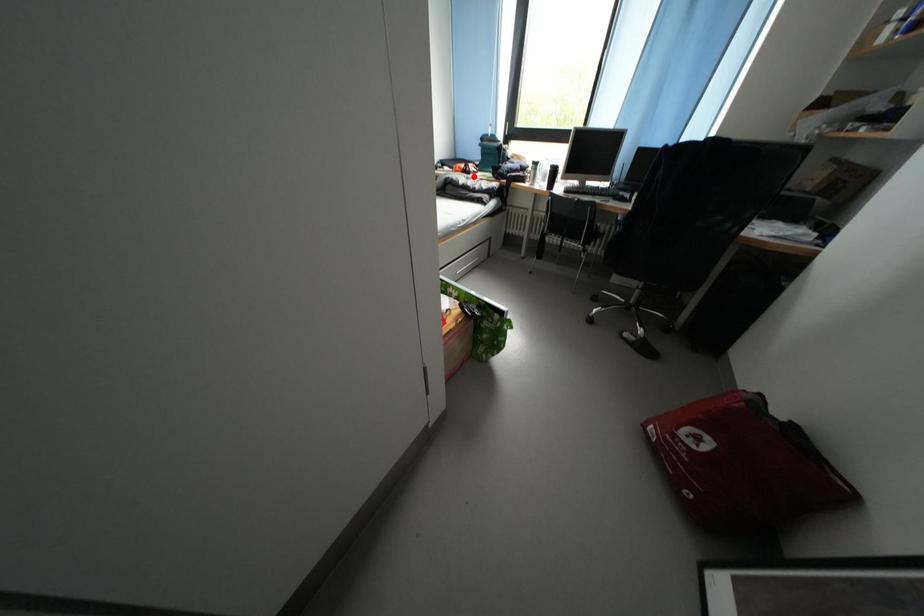
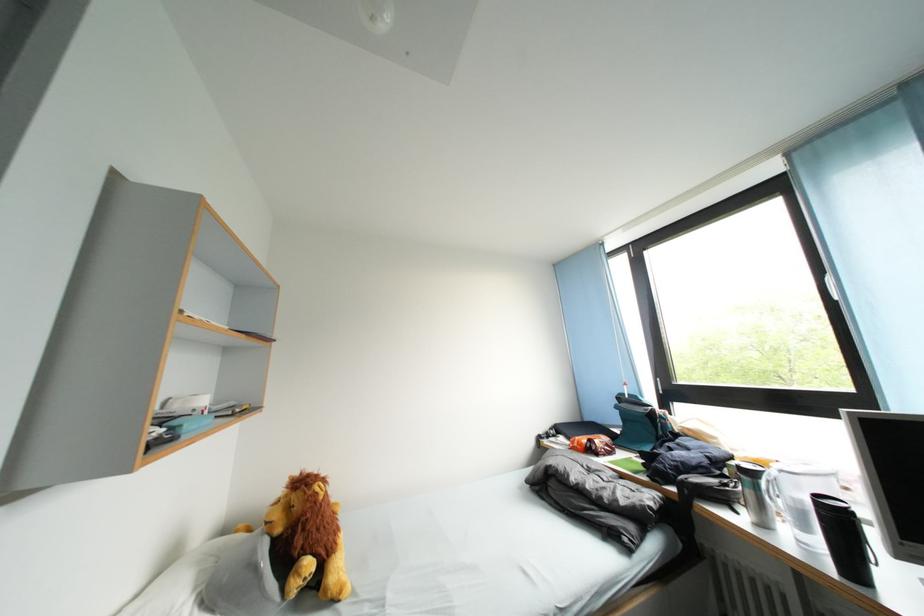
In the second image, find the point that corresponds to the highlighted location in the first image.

(600, 455)